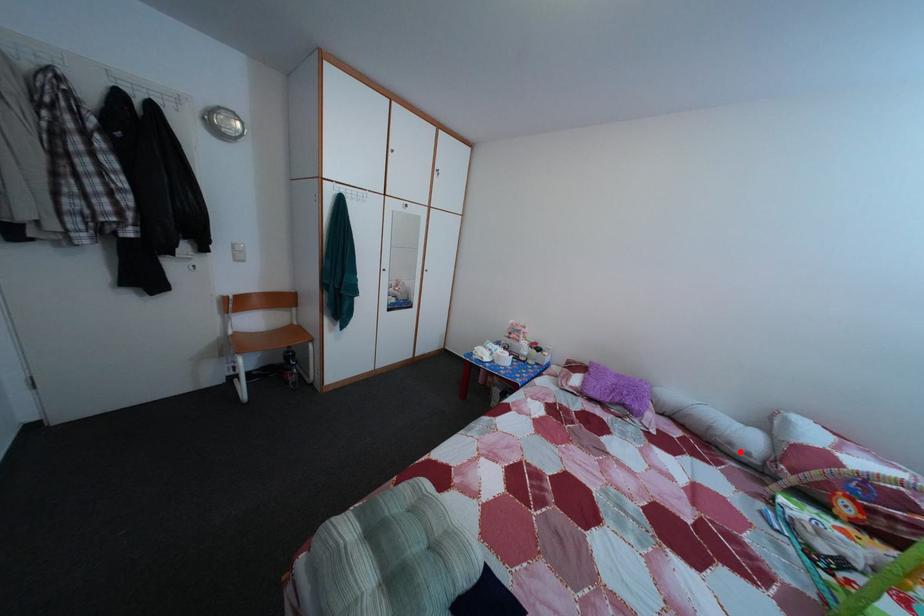
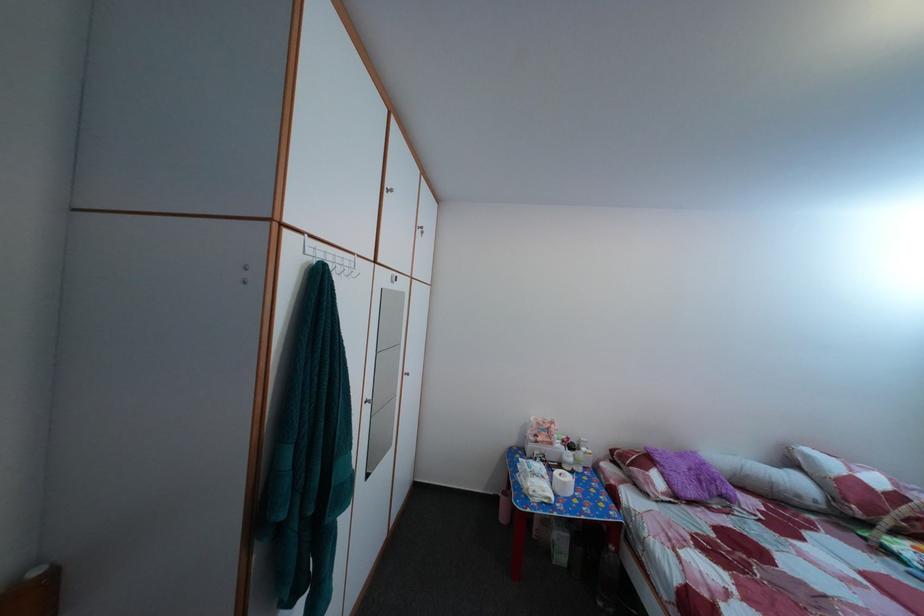
The point at the highlighted location is marked in the first image. Where is the corresponding point in the second image?

(808, 504)